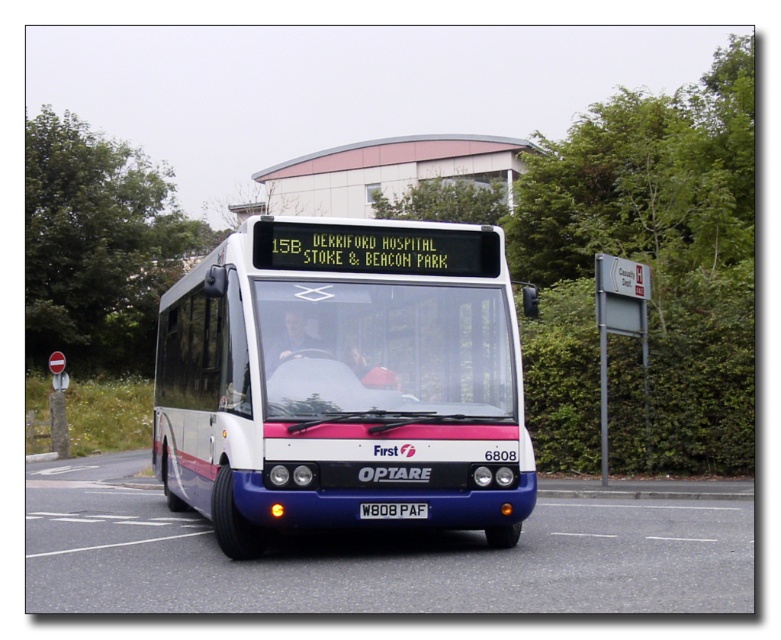
Question: Is metal sign at right to the right of black plastic license plate at center from the viewer's perspective?

Choices:
 (A) no
 (B) yes

Answer: (B)

Question: Does white glossy bus at center have a larger size compared to metal sign at right?

Choices:
 (A) yes
 (B) no

Answer: (B)

Question: Which object is positioned closest to the black plastic license plate at center?

Choices:
 (A) white glossy bus at center
 (B) metal sign at right

Answer: (A)

Question: Can you confirm if white glossy bus at center is bigger than metal sign at right?

Choices:
 (A) no
 (B) yes

Answer: (A)

Question: Which object appears closest to the camera in this image?

Choices:
 (A) black plastic license plate at center
 (B) white glossy bus at center
 (C) metal sign at right

Answer: (A)

Question: Which point is farther to the camera?

Choices:
 (A) metal sign at right
 (B) black plastic license plate at center
 (C) white glossy bus at center

Answer: (A)